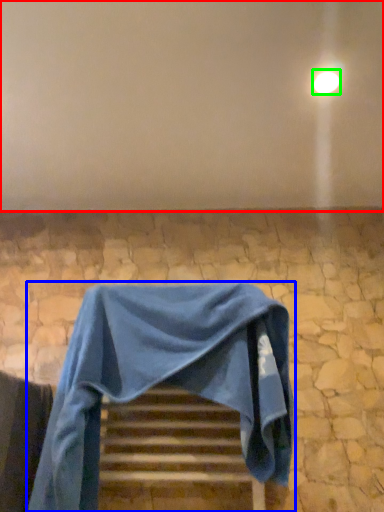
Question: Considering the real-world distances, which object is closest to backdrop (highlighted by a red box)? furniture (highlighted by a blue box) or light (highlighted by a green box).

Choices:
 (A) furniture
 (B) light

Answer: (B)